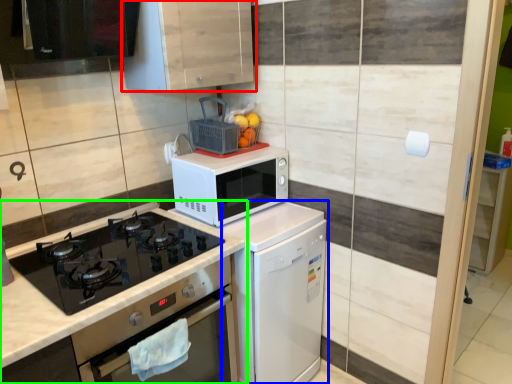
Question: Estimate the real-world distances between objects in this image. Which object is closer to cabinetry (highlighted by a red box), dish washer (highlighted by a blue box) or countertop (highlighted by a green box)?

Choices:
 (A) dish washer
 (B) countertop

Answer: (B)